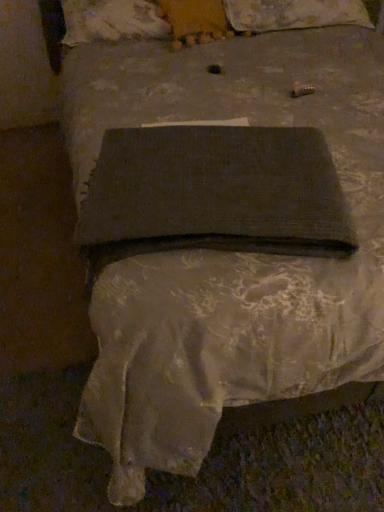
Question: Which direction should I rotate to look at fluffy white pillow at upper center, the first pillow viewed from the right, — up or down?

Choices:
 (A) up
 (B) down

Answer: (A)

Question: Is fluffy white pillow at upper center, the first pillow viewed from the right, facing towards fluffy beige pillow at upper center, the first pillow from the left?

Choices:
 (A) yes
 (B) no

Answer: (B)

Question: Does fluffy white pillow at upper center, the first pillow viewed from the right, have a lesser height compared to fluffy beige pillow at upper center, the first pillow from the left?

Choices:
 (A) yes
 (B) no

Answer: (A)

Question: Can you confirm if fluffy white pillow at upper center, the first pillow viewed from the right, is bigger than fluffy beige pillow at upper center, the first pillow from the left?

Choices:
 (A) no
 (B) yes

Answer: (B)

Question: Is fluffy white pillow at upper center, the 2th pillow in the left-to-right sequence, positioned with its back to fluffy beige pillow at upper center, the first pillow from the left?

Choices:
 (A) no
 (B) yes

Answer: (A)

Question: From a real-world perspective, is fluffy white pillow at upper center, the first pillow viewed from the right, over fluffy beige pillow at upper center, which ranks as the 2th pillow in right-to-left order?

Choices:
 (A) yes
 (B) no

Answer: (B)

Question: Is fluffy white pillow at upper center, the first pillow viewed from the right, at the left side of fluffy beige pillow at upper center, which ranks as the 2th pillow in right-to-left order?

Choices:
 (A) no
 (B) yes

Answer: (A)

Question: Considering the relative sizes of fluffy white pillow at upper center, the 2th pillow in the left-to-right sequence, and dark fabric book at center in the image provided, is fluffy white pillow at upper center, the 2th pillow in the left-to-right sequence, taller than dark fabric book at center?

Choices:
 (A) no
 (B) yes

Answer: (B)

Question: Is fluffy white pillow at upper center, the first pillow viewed from the right, thinner than dark fabric book at center?

Choices:
 (A) yes
 (B) no

Answer: (B)

Question: From the image's perspective, is fluffy white pillow at upper center, the 2th pillow in the left-to-right sequence, located above dark fabric book at center?

Choices:
 (A) yes
 (B) no

Answer: (A)

Question: Is fluffy white pillow at upper center, the first pillow viewed from the right, located outside dark fabric book at center?

Choices:
 (A) yes
 (B) no

Answer: (A)

Question: Does fluffy white pillow at upper center, the 2th pillow in the left-to-right sequence, turn towards dark fabric book at center?

Choices:
 (A) no
 (B) yes

Answer: (B)

Question: From a real-world perspective, does fluffy white pillow at upper center, the first pillow viewed from the right, stand above dark fabric book at center?

Choices:
 (A) no
 (B) yes

Answer: (A)

Question: Is dark fabric book at center not near fluffy white pillow at upper center, the first pillow viewed from the right?

Choices:
 (A) yes
 (B) no

Answer: (A)